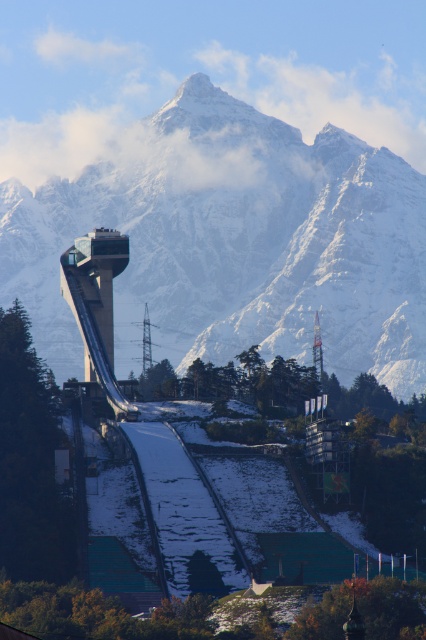
From the picture: What is the spatial relationship between the snowy granite mountain range at center and the ski jump facility in the image?

The snowy granite mountain range at center is located at point coordinates approximately [238,244], which places it centrally within the image frame, likely behind or adjacent to the ski jump facility depending on the perspective.

You are a drone operator tasked with capturing aerial footage of the snowy white ski slope at center. Your drone has a maximum flight range of 100 meters from your current position. Based on the coordinates provided, can your drone reach the slope?

The snowy white ski slope at center is located at coordinates point [184,515], so the drone can reach it within its 100 meters range as the distance is well within the limit.

You are a skier planning your descent down the snowy white ski slope at center. You notice the snowy granite mountain range at center in the distance. Which feature is higher in elevation?

The snowy granite mountain range at center is taller than the snowy white ski slope at center, so the mountain range is higher in elevation.